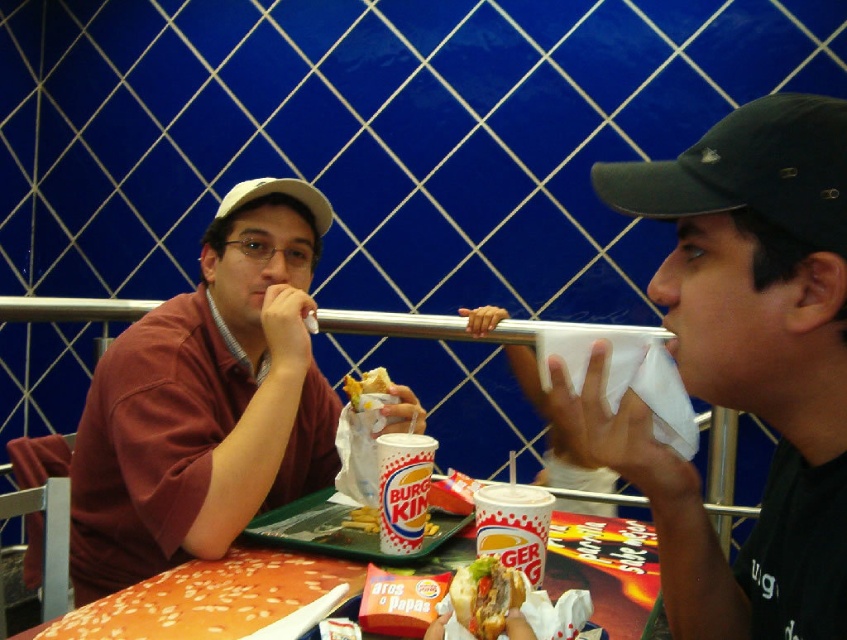
Who is shorter, white paper cup at center or golden crispy chicken at center?

Standing shorter between the two is golden crispy chicken at center.

Where is `white paper cup at center`? This screenshot has width=847, height=640. white paper cup at center is located at coordinates (403, 490).

Measure the distance between point (396,451) and camera.

Point (396,451) is 97.57 centimeters from camera.

This screenshot has width=847, height=640. Identify the location of white paper cup at center. (403, 490).

Who is positioned more to the right, shiny golden bun at center or white matte baseball cap at upper left?

From the viewer's perspective, shiny golden bun at center appears more on the right side.

Is point (495, 580) closer to viewer compared to point (325, 205)?

Yes, it is in front of point (325, 205).

The image size is (847, 640). Describe the element at coordinates (485, 596) in the screenshot. I see `shiny golden bun at center` at that location.

The height and width of the screenshot is (640, 847). Find the location of `shiny golden bun at center`. shiny golden bun at center is located at coordinates (485, 596).

Consider the image. Is black matte baseball cap at right bigger than white paper cup at center?

Yes.

Does black matte baseball cap at right appear on the right side of white paper cup at center?

Correct, you'll find black matte baseball cap at right to the right of white paper cup at center.

You are a GUI agent. You are given a task and a screenshot of the screen. Output one action in this format:
    pyautogui.click(x=<x>, y=<y>)
    Task: Click on the black matte baseball cap at right
    The width and height of the screenshot is (847, 640).
    Given the screenshot: What is the action you would take?
    pyautogui.click(x=750, y=172)